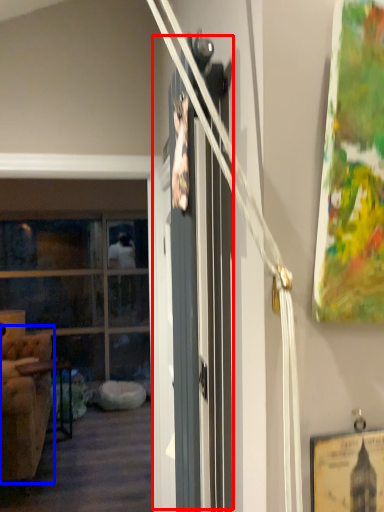
Question: Among these objects, which one is farthest to the camera, barn door (highlighted by a red box) or armchair (highlighted by a blue box)?

Choices:
 (A) barn door
 (B) armchair

Answer: (B)